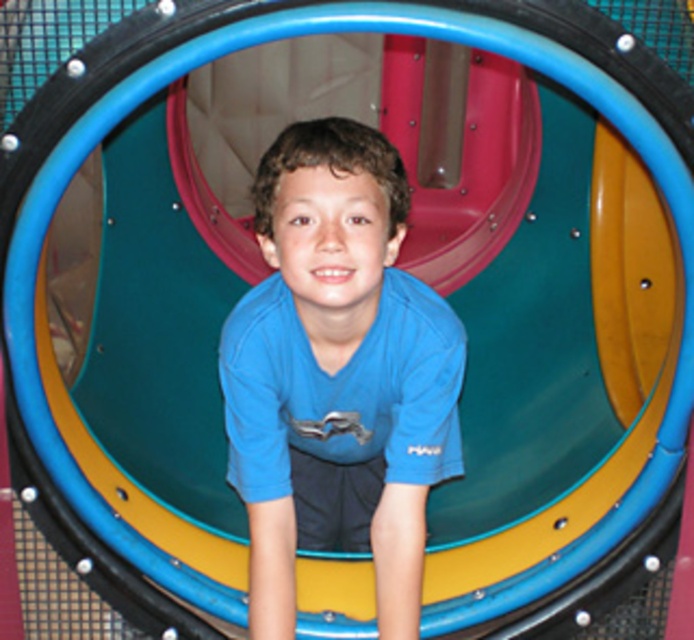
Question: Which of the following is the closest to the observer?

Choices:
 (A) blue matte shirt at center
 (B) matte blue shirt at center

Answer: (A)

Question: Is blue matte shirt at center further to camera compared to matte blue shirt at center?

Choices:
 (A) yes
 (B) no

Answer: (B)

Question: Which of the following is the closest to the observer?

Choices:
 (A) matte blue shirt at center
 (B) blue matte shirt at center

Answer: (B)

Question: Considering the relative positions of blue matte shirt at center and matte blue shirt at center in the image provided, where is blue matte shirt at center located with respect to matte blue shirt at center?

Choices:
 (A) above
 (B) below

Answer: (B)

Question: Can you confirm if blue matte shirt at center is wider than matte blue shirt at center?

Choices:
 (A) no
 (B) yes

Answer: (B)